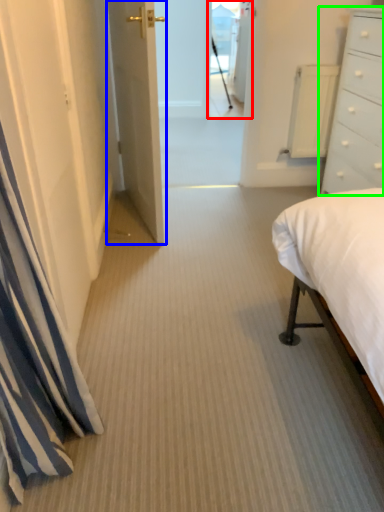
Question: Estimate the real-world distances between objects in this image. Which object is closer to glass door (highlighted by a red box), door (highlighted by a blue box) or chest of drawers (highlighted by a green box)?

Choices:
 (A) door
 (B) chest of drawers

Answer: (A)